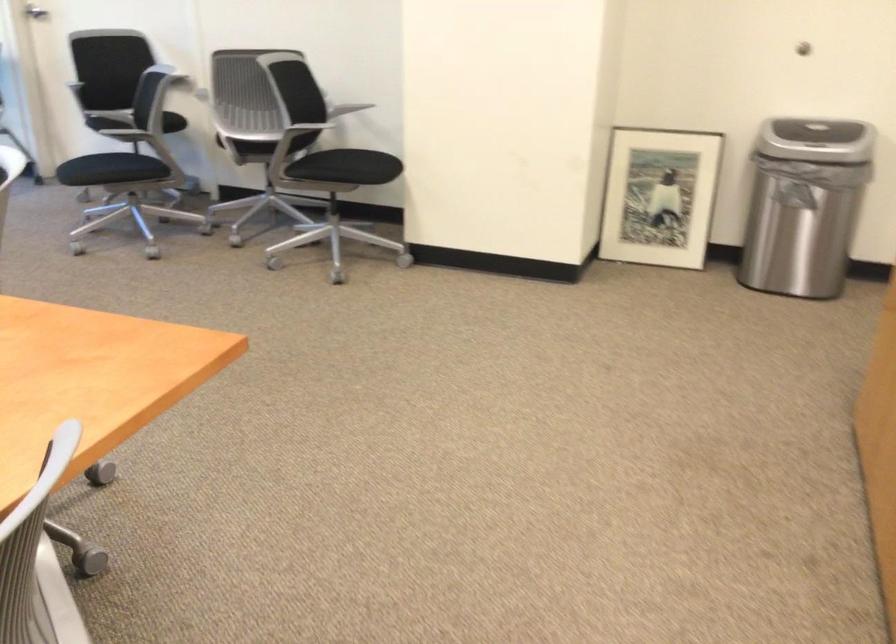
I want to click on trash can lid, so click(821, 131).